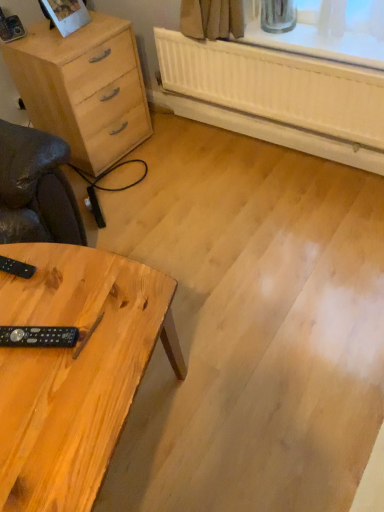
Locate an element on the screen. The width and height of the screenshot is (384, 512). vacant space in front of black plastic remote at lower left, marked as the 2th control in a front-to-back arrangement is located at coordinates (26, 312).